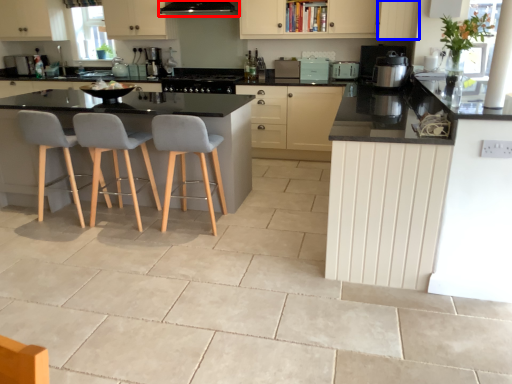
Question: Among these objects, which one is farthest to the camera, exhaust hood (highlighted by a red box) or cabinetry (highlighted by a blue box)?

Choices:
 (A) exhaust hood
 (B) cabinetry

Answer: (A)